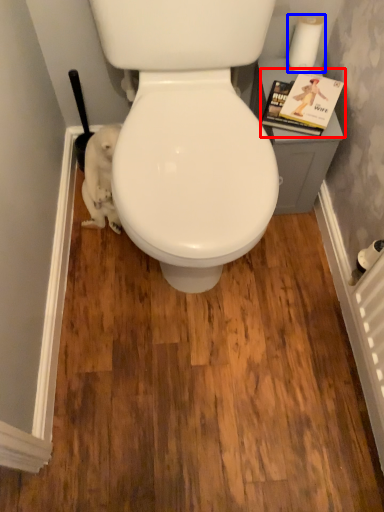
Question: Which object is further to the camera taking this photo, magazine (highlighted by a red box) or toilet paper (highlighted by a blue box)?

Choices:
 (A) magazine
 (B) toilet paper

Answer: (B)